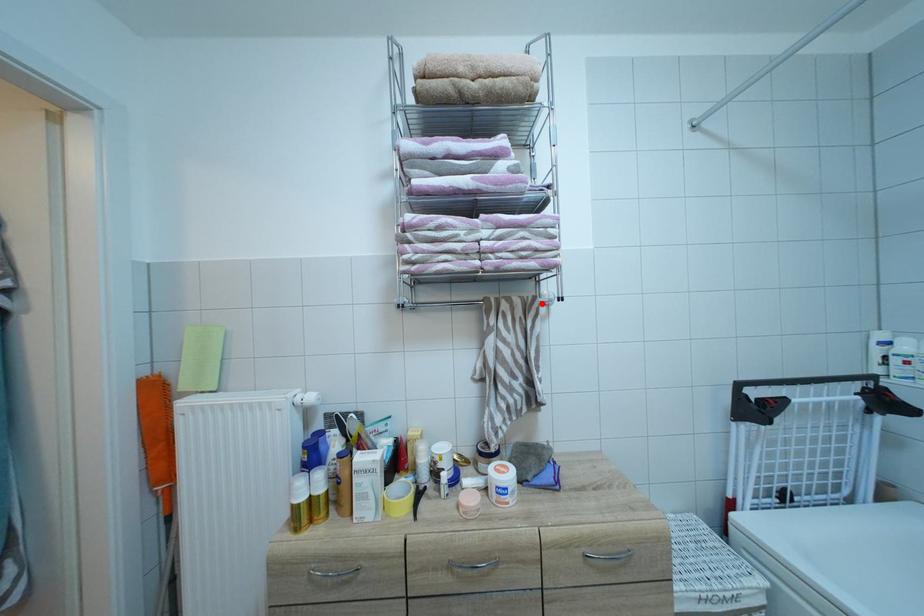
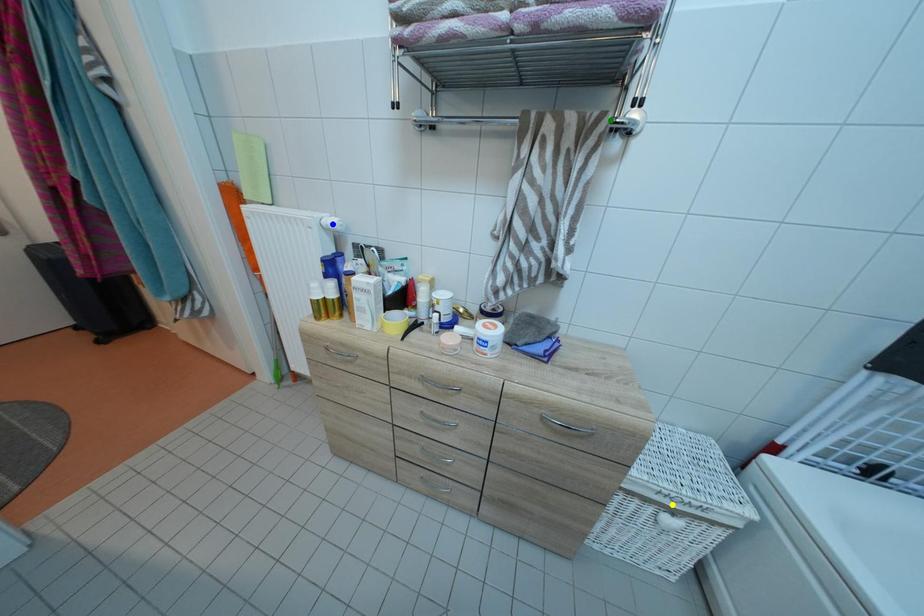
Question: I am providing you with two images of the same scene from different viewpoints. A red point is marked on the first image. You are given multiple points on the second image. In image 2, which mark is for the same physical point as the one in image 1?

Choices:
 (A) yellow point
 (B) green point
 (C) blue point

Answer: (B)